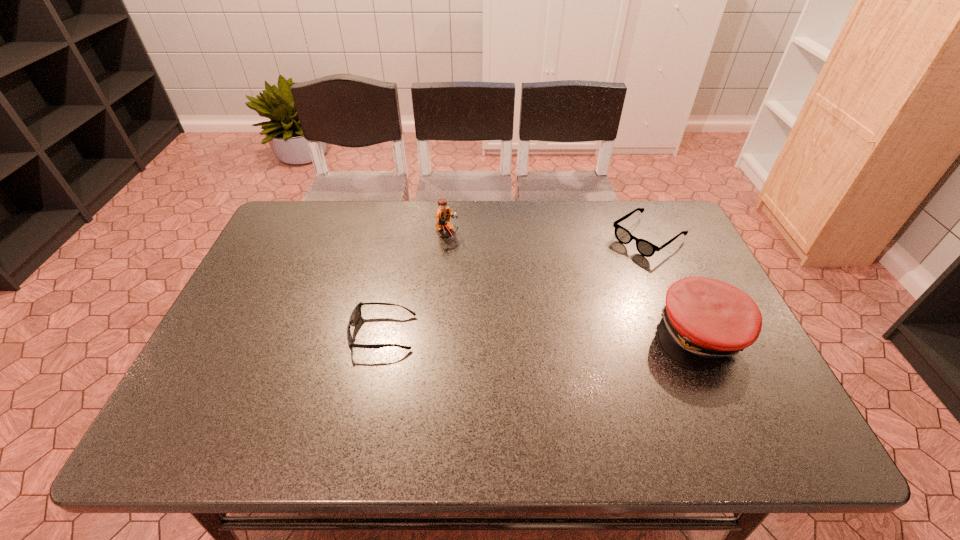
This screenshot has width=960, height=540. In the image, there is a desktop. Find the location of `vacant space at the far edge`. vacant space at the far edge is located at coordinates (368, 207).

Find the location of a particular element. The width and height of the screenshot is (960, 540). free space at the near edge of the desktop is located at coordinates (582, 377).

In the image, there is a desktop. Where is `vacant space at the left edge`? Image resolution: width=960 pixels, height=540 pixels. vacant space at the left edge is located at coordinates (256, 269).

You are a GUI agent. You are given a task and a screenshot of the screen. Output one action in this format:
    pyautogui.click(x=<x>, y=<y>)
    Task: Click on the vacant space at the far left corner
    Image resolution: width=960 pixels, height=540 pixels.
    Given the screenshot: What is the action you would take?
    pyautogui.click(x=322, y=223)

At what (x,y) coordinates should I click in order to perform the action: click on free space at the near right corner of the desktop. Please return your answer as a coordinate pair (x, y). Image resolution: width=960 pixels, height=540 pixels. Looking at the image, I should click on (729, 404).

This screenshot has height=540, width=960. I want to click on vacant area between the third tallest object and the Lego, so click(547, 235).

You are a GUI agent. You are given a task and a screenshot of the screen. Output one action in this format:
    pyautogui.click(x=<x>, y=<y>)
    Task: Click on the free space that is in between the spectacles and the sunglasses
    
    Given the screenshot: What is the action you would take?
    pyautogui.click(x=516, y=286)

Locate an element on the screen. Image resolution: width=960 pixels, height=540 pixels. unoccupied position between the cap and the sunglasses is located at coordinates (540, 334).

This screenshot has width=960, height=540. What are the coordinates of `vacant area that lies between the leftmost object and the spectacles` in the screenshot? It's located at (516, 286).

You are a GUI agent. You are given a task and a screenshot of the screen. Output one action in this format:
    pyautogui.click(x=<x>, y=<y>)
    Task: Click on the free space between the Lego and the third tallest object
    Image resolution: width=960 pixels, height=540 pixels.
    Given the screenshot: What is the action you would take?
    pyautogui.click(x=547, y=235)